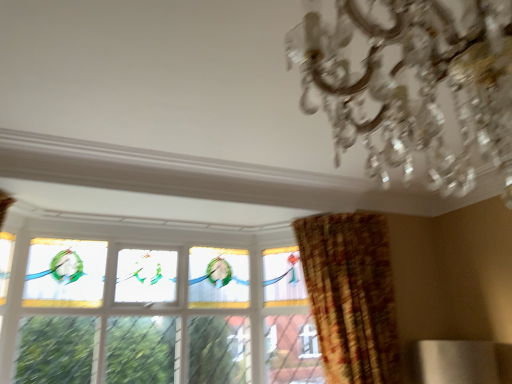
Question: From their relative heights in the image, would you say plaid fabric curtain at right is taller or shorter than stained glass window at center?

Choices:
 (A) tall
 (B) short

Answer: (B)

Question: Is plaid fabric curtain at right bigger or smaller than stained glass window at center?

Choices:
 (A) big
 (B) small

Answer: (A)

Question: Considering the real-world distances, which object is farthest from the clear crystal chandelier at upper right?

Choices:
 (A) stained glass window at center
 (B) plaid fabric curtain at right

Answer: (A)

Question: Which object is positioned farthest from the plaid fabric curtain at right?

Choices:
 (A) clear crystal chandelier at upper right
 (B) stained glass window at center

Answer: (A)